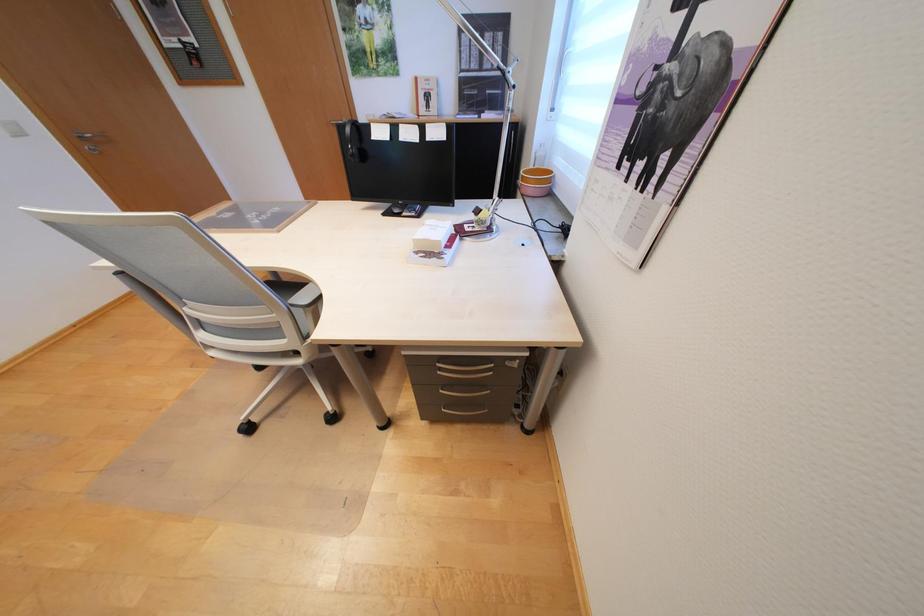
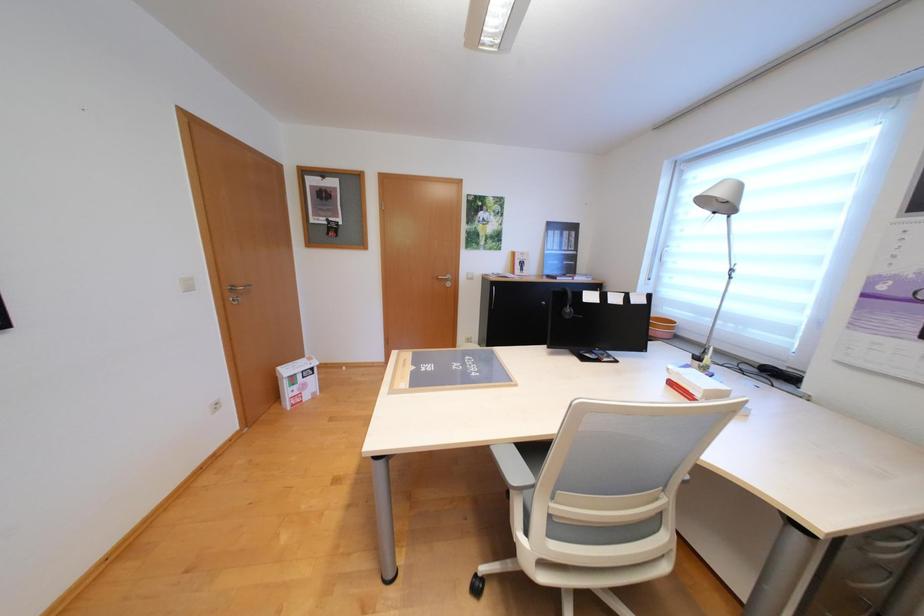
Question: In a continuous first-person perspective shot, in which direction is the camera moving?

Choices:
 (A) Left
 (B) Right
 (C) Forward
 (D) Backward

Answer: (A)